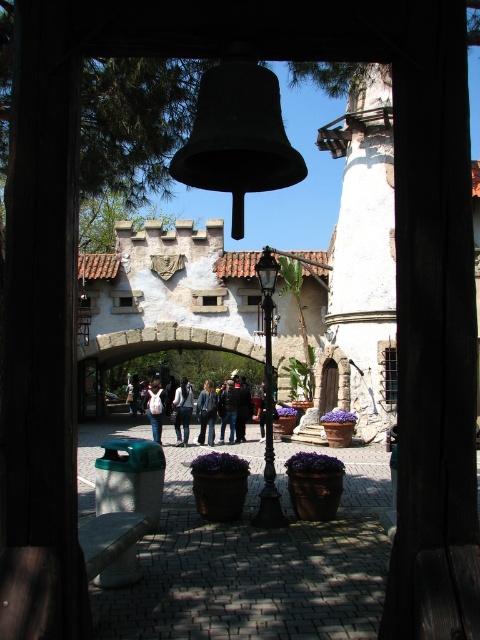
Is blue denim jeans at center closer to the viewer compared to white cotton shirt at center?

Yes, blue denim jeans at center is closer to the viewer.

The height and width of the screenshot is (640, 480). What do you see at coordinates (206, 412) in the screenshot? I see `blue denim jeans at center` at bounding box center [206, 412].

Locate an element on the screen. blue denim jeans at center is located at coordinates (206, 412).

Is point (227, 396) in front of point (153, 413)?

No, (227, 396) is behind (153, 413).

Does dark blue jeans at center come behind white cotton shirt at center?

Yes, dark blue jeans at center is further from the viewer.

You are a GUI agent. You are given a task and a screenshot of the screen. Output one action in this format:
    pyautogui.click(x=<x>, y=<y>)
    Task: Click on the dark blue jeans at center
    The width and height of the screenshot is (480, 640).
    Given the screenshot: What is the action you would take?
    pyautogui.click(x=228, y=410)

Is denim jacket at center thinner than blue denim jeans at center?

No.

Between denim jacket at center and blue denim jeans at center, which one is positioned lower?

blue denim jeans at center is below.

The image size is (480, 640). Identify the location of denim jacket at center. (181, 410).